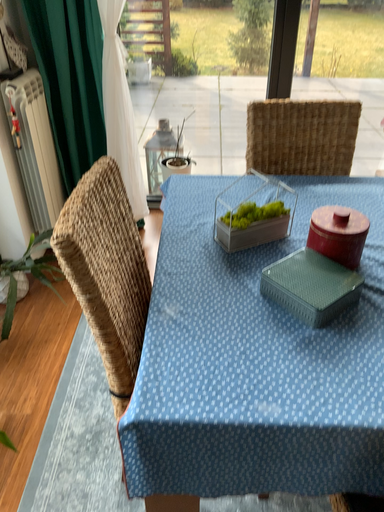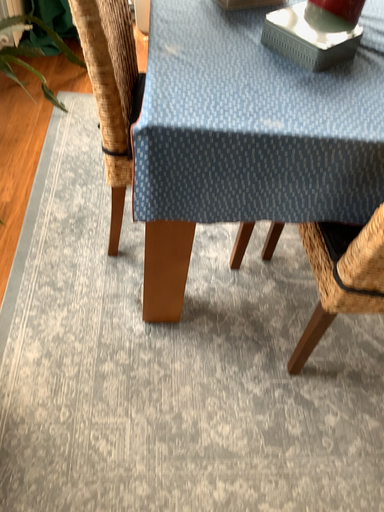
Question: How did the camera likely rotate when shooting the video?

Choices:
 (A) rotated right
 (B) rotated left

Answer: (A)